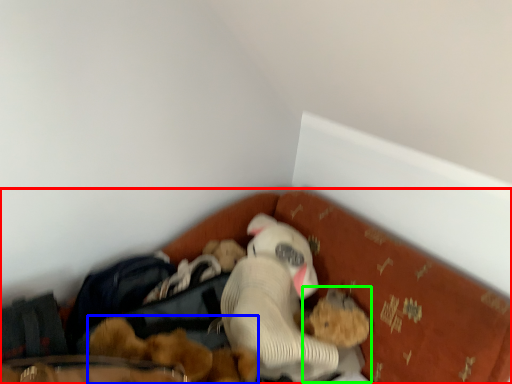
Question: Which object is the closest to the bed (highlighted by a red box)? Choose among these: toy (highlighted by a blue box) or toy (highlighted by a green box).

Choices:
 (A) toy
 (B) toy

Answer: (A)